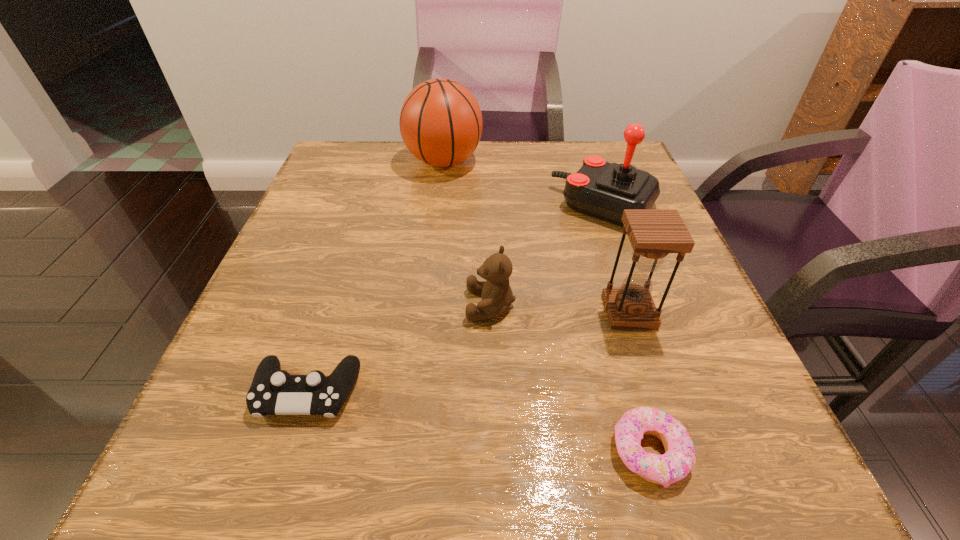
The width and height of the screenshot is (960, 540). I want to click on vacant space that satisfies the following two spatial constraints: 1. on the front side of the basketball; 2. on the left side of the hourglass, so click(x=426, y=312).

Identify the location of vacant region that satisfies the following two spatial constraints: 1. on the surface of the control; 2. on the left side of the doughnut. (287, 453).

The height and width of the screenshot is (540, 960). I want to click on free spot that satisfies the following two spatial constraints: 1. on the front-facing side of the hourglass; 2. on the left side of the fourth tallest object, so click(x=491, y=312).

In order to click on free point that satisfies the following two spatial constraints: 1. on the surface of the doughnut; 2. on the right side of the fifth tallest object in this screenshot , I will do `click(287, 453)`.